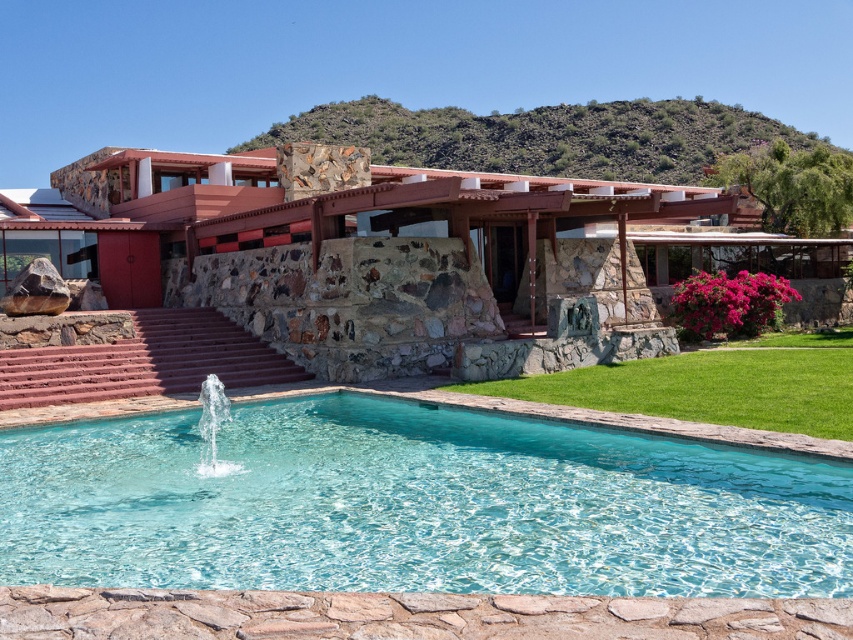
Does clear glass pool at center appear over green grass at lower center?

Incorrect, clear glass pool at center is not positioned above green grass at lower center.

Can you confirm if clear glass pool at center is bigger than green grass at lower center?

No.

At what (x,y) coordinates should I click in order to perform the action: click on clear glass pool at center. Please return your answer as a coordinate pair (x, y). Image resolution: width=853 pixels, height=640 pixels. Looking at the image, I should click on (415, 506).

Between clear glass pool at center and rustic stone villa at center, which one is positioned lower?

clear glass pool at center

The height and width of the screenshot is (640, 853). I want to click on clear glass pool at center, so click(415, 506).

Locate an element on the screen. This screenshot has width=853, height=640. clear glass pool at center is located at coordinates (415, 506).

Which is more to the left, green grass at lower center or clear glass water at center?

clear glass water at center

Describe the element at coordinates (709, 388) in the screenshot. I see `green grass at lower center` at that location.

The width and height of the screenshot is (853, 640). In order to click on green grass at lower center in this screenshot , I will do `click(709, 388)`.